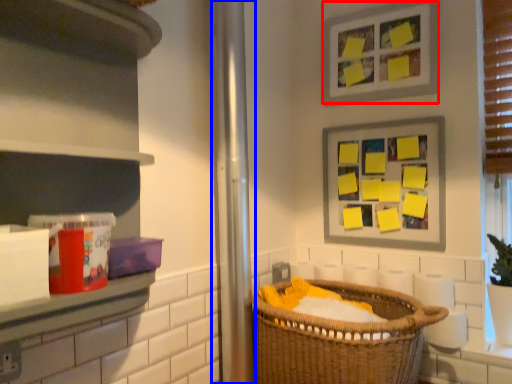
Question: Which of the following is the closest to the observer, picture frame (highlighted by a red box) or screen door (highlighted by a blue box)?

Choices:
 (A) picture frame
 (B) screen door

Answer: (B)